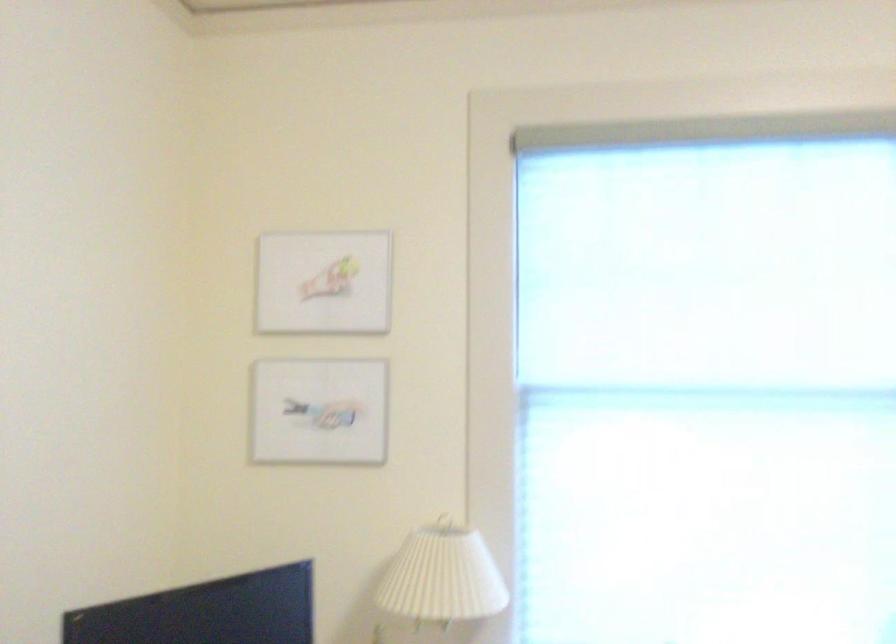
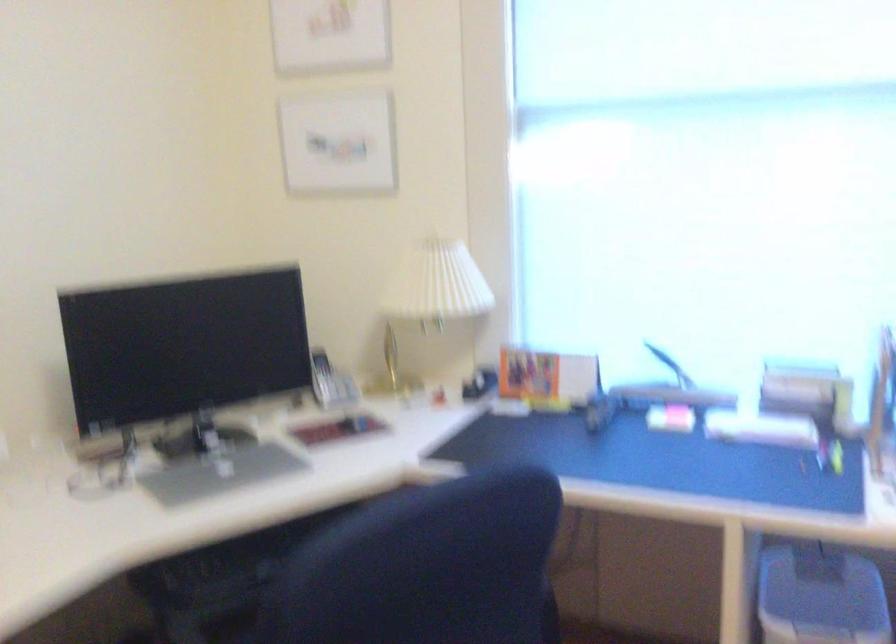
Question: What movement of the cameraman would produce the second image?

Choices:
 (A) Left
 (B) Right
 (C) Forward
 (D) Backward

Answer: (B)